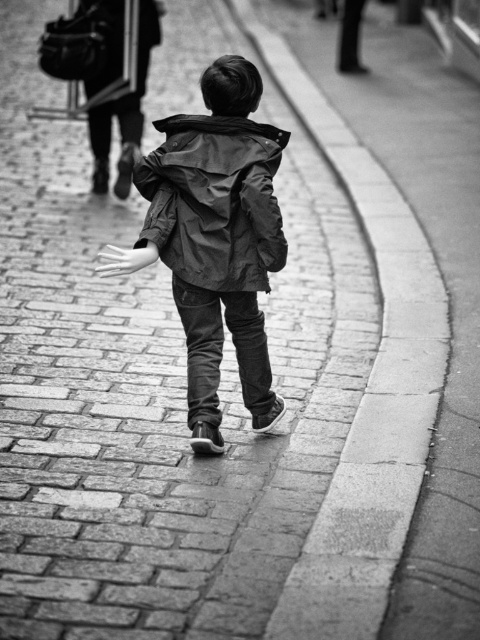
Based on the scene description, which object is higher in elevation between the smooth concrete curb at center and the matte black trench coat at upper center?

The smooth concrete curb at center is much taller than the matte black trench coat at upper center, so it is higher in elevation.

Based on the scene described, which object is shorter when comparing the dark green fabric jacket at center and the matte black trench coat at upper center?

The dark green fabric jacket at center is shorter than the matte black trench coat at upper center according to the description.

Based on the scene, if the child wearing the matte black trench coat at upper center wants to step onto the smooth concrete curb at center, which direction should they move towards?

The smooth concrete curb at center is in front of the matte black trench coat at upper center, so the child should move forward towards the direction they are facing to step onto the curb.